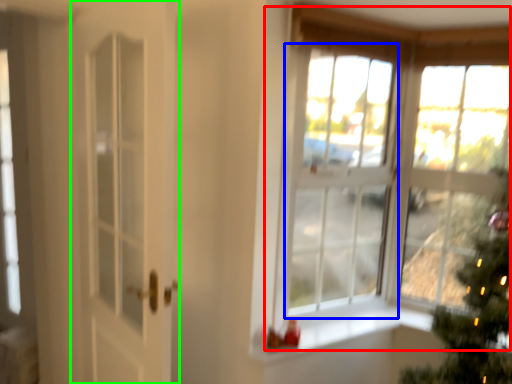
Question: Which is nearer to the window (highlighted by a red box)? window (highlighted by a blue box) or door (highlighted by a green box).

Choices:
 (A) window
 (B) door

Answer: (A)